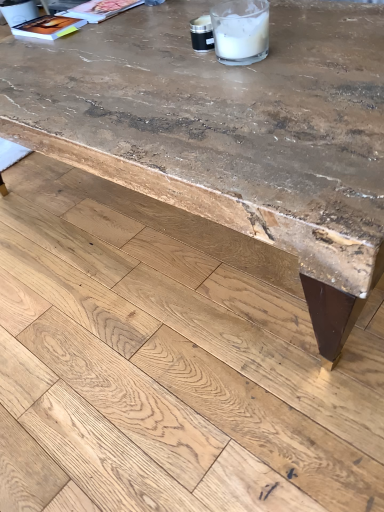
Question: Is rough concrete table at upper center taller or shorter than matte paper magazine at upper left, the 1th magazine when ordered from right to left?

Choices:
 (A) short
 (B) tall

Answer: (B)

Question: In the image, is rough concrete table at upper center on the left side or the right side of matte paper magazine at upper left, which ranks as the second magazine in left-to-right order?

Choices:
 (A) left
 (B) right

Answer: (A)

Question: Estimate the real-world distances between objects in this image. Which object is farther from the matte paper magazine at upper left, which is counted as the 1th magazine, starting from the left?

Choices:
 (A) rustic wood table at center
 (B) rough concrete table at upper center
 (C) matte paper magazine at upper left, which ranks as the second magazine in left-to-right order
 (D) clear plastic straw at upper center

Answer: (B)

Question: Which object is positioned farthest from the rough concrete table at upper center?

Choices:
 (A) matte paper magazine at upper left, the second magazine from the right
 (B) clear plastic straw at upper center
 (C) rustic wood table at center
 (D) matte paper magazine at upper left, the 1th magazine when ordered from right to left

Answer: (D)